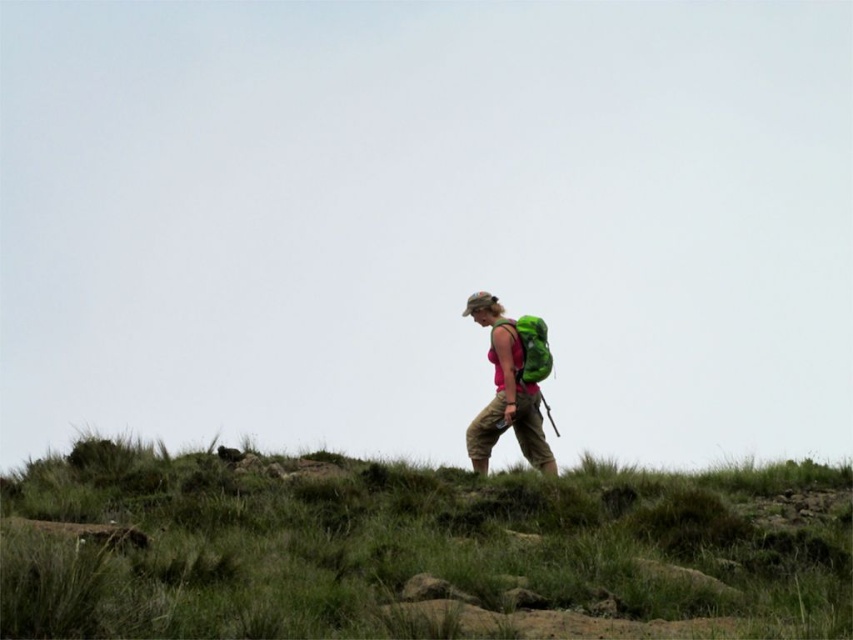
Is point (761, 556) farther from viewer compared to point (525, 344)?

No, it is in front of (525, 344).

Does green grassy hillside at center come behind green fabric backpack at right?

That is False.

Which is behind, point (718, 561) or point (537, 353)?

Point (537, 353)

Where is `green grassy hillside at center`? green grassy hillside at center is located at coordinates [x=416, y=545].

Between green grassy hillside at center and green fabric backpack at center-right, which one is positioned higher?

Positioned higher is green fabric backpack at center-right.

Who is shorter, green grassy hillside at center or green fabric backpack at center-right?

green grassy hillside at center is shorter.

Where is `green grassy hillside at center`? The height and width of the screenshot is (640, 853). green grassy hillside at center is located at coordinates (416, 545).

Can you confirm if green fabric backpack at center-right is taller than green fabric backpack at right?

Yes.

Is point (531, 356) positioned behind point (544, 346)?

No, (531, 356) is closer to viewer.

Locate an element on the screen. This screenshot has height=640, width=853. green fabric backpack at center-right is located at coordinates (511, 385).